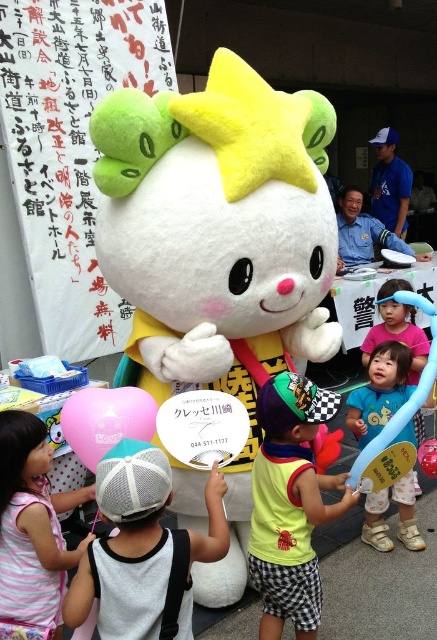
Question: Is yellow fabric shirt at center to the right of pink matte balloon at lower left from the viewer's perspective?

Choices:
 (A) no
 (B) yes

Answer: (B)

Question: Based on their relative distances, which object is farther from the blue fabric hat at lower right?

Choices:
 (A) blue fabric cap at upper center
 (B) fluffy plush toy at center
 (C) white mesh cap at center

Answer: (A)

Question: Which of the following is the farthest from the observer?

Choices:
 (A) (179, 522)
 (B) (128, 388)

Answer: (A)

Question: Does pink matte balloon at lower left appear on the left side of blue fabric cap at upper center?

Choices:
 (A) no
 (B) yes

Answer: (B)

Question: Among these points, which one is nearest to the camera?

Choices:
 (A) (6, 464)
 (B) (141, 419)
 (C) (396, 285)

Answer: (A)

Question: Can you confirm if fluffy plush toy at center is wider than pink polka dot dress at lower left?

Choices:
 (A) no
 (B) yes

Answer: (B)